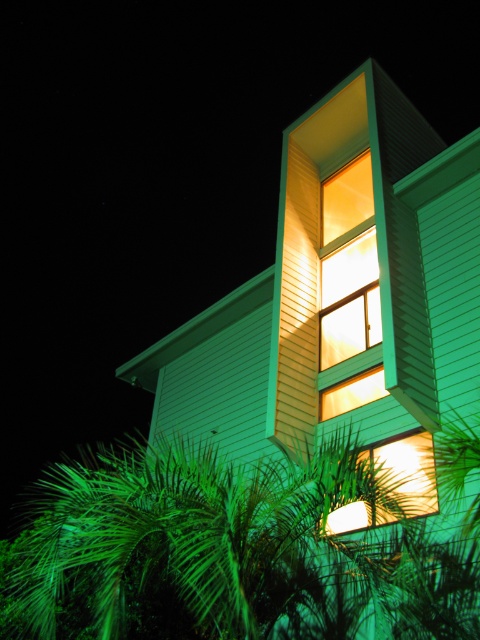
Who is more distant from viewer, (x=360, y=348) or (x=387, y=465)?

The point (x=360, y=348) is more distant.

This screenshot has width=480, height=640. I want to click on matte glass window at center, so click(348, 264).

At what (x,y) coordinates should I click in order to perform the action: click on matte glass window at center. Please return your answer as a coordinate pair (x, y). Looking at the image, I should click on (348, 264).